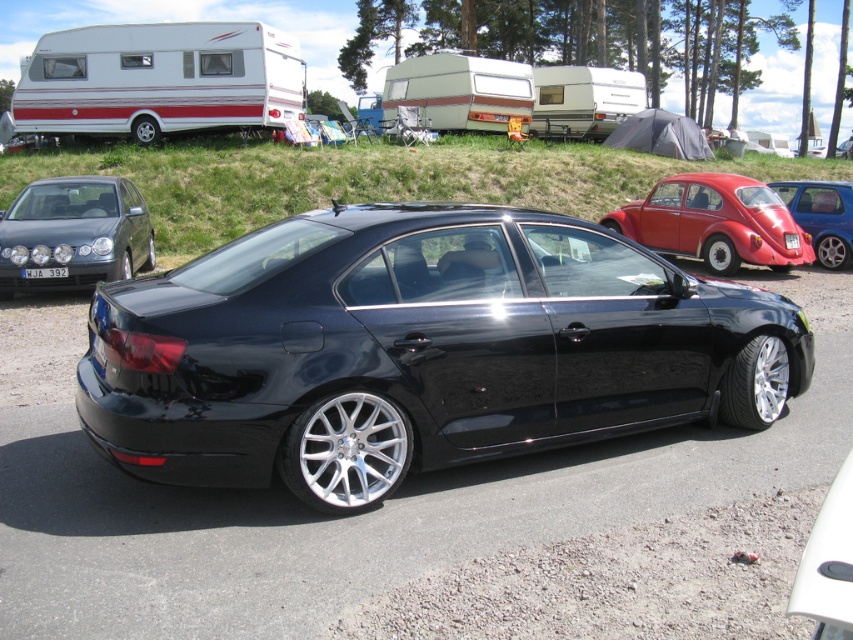
Question: Which object appears closest to the camera in this image?

Choices:
 (A) black plastic license plate at center
 (B) white glossy bumper at lower right
 (C) white plastic license plate at center
 (D) matte red car at right

Answer: (B)

Question: Is white glossy bumper at lower right thinner than metallic red car at right?

Choices:
 (A) yes
 (B) no

Answer: (A)

Question: Which of the following is the farthest from the observer?

Choices:
 (A) matte red car at right
 (B) white glossy caravan at upper left

Answer: (B)

Question: Can you confirm if white plastic license plate at center is positioned to the left of black plastic license plate at center?

Choices:
 (A) no
 (B) yes

Answer: (B)

Question: Which object is closer to the camera taking this photo?

Choices:
 (A) black plastic license plate at center
 (B) satin silver sedan at center
 (C) metallic red car at right
 (D) white glossy caravan at upper left

Answer: (B)

Question: Does matte red car at right lie in front of black plastic license plate at center?

Choices:
 (A) yes
 (B) no

Answer: (A)